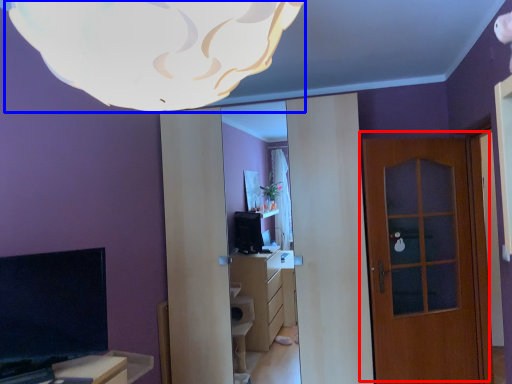
Question: Among these objects, which one is farthest to the camera, door (highlighted by a red box) or lamp (highlighted by a blue box)?

Choices:
 (A) door
 (B) lamp

Answer: (A)